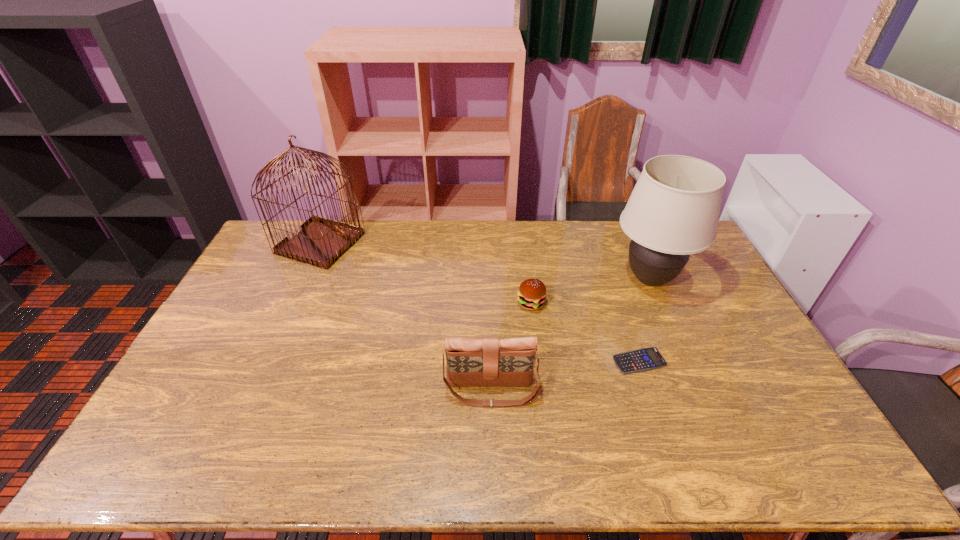
I want to click on vacant area between the birdcage and the hamburger, so click(x=426, y=273).

This screenshot has width=960, height=540. In order to click on empty space that is in between the hamburger and the lampshade in this screenshot , I will do `click(590, 292)`.

In order to click on free area in between the birdcage and the lampshade in this screenshot , I will do `click(485, 261)`.

Where is `vacant area between the second shortest object and the calculator`? vacant area between the second shortest object and the calculator is located at coordinates (585, 332).

What are the coordinates of `vacant space in between the calculator and the shoulder bag` in the screenshot? It's located at (565, 376).

Find the location of `free space between the lampshade and the birdcage`. free space between the lampshade and the birdcage is located at coordinates (485, 261).

I want to click on empty space between the birdcage and the fourth tallest object, so click(426, 273).

Where is `vacant space that's between the hamburger and the calculator`? The height and width of the screenshot is (540, 960). vacant space that's between the hamburger and the calculator is located at coordinates (585, 332).

Find the location of a particular element. free space between the calculator and the lampshade is located at coordinates (644, 320).

The height and width of the screenshot is (540, 960). Identify the location of object that is the fourth closest to the calculator. (321, 242).